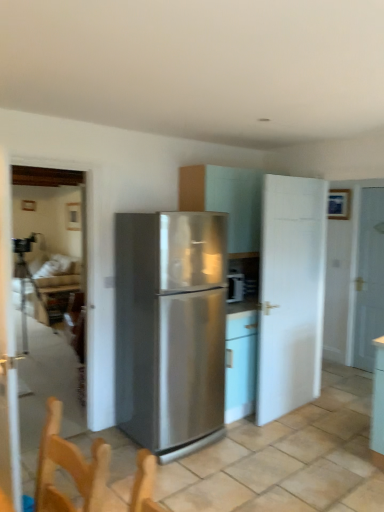
Question: Is clear glass door at left, the 1th glass door viewed from the back, taller or shorter than stainless steel refrigerator at center?

Choices:
 (A) short
 (B) tall

Answer: (B)

Question: In the image, is clear glass door at left, which ranks as the 2th glass door in front-to-back order, on the left side or the right side of stainless steel refrigerator at center?

Choices:
 (A) right
 (B) left

Answer: (B)

Question: Which object is the closest to the wooden table at lower left?

Choices:
 (A) matte white cabinet at center
 (B) stainless steel refrigerator at center
 (C) clear glass door at left, the 1th glass door viewed from the back
 (D) white matte door at right, the second door viewed from the left
 (E) transparent glass door at left, which is the first glass door from front to back

Answer: (C)

Question: Estimate the real-world distances between objects in this image. Which object is closer to the white matte door at center-right, acting as the 1th door starting from the front?

Choices:
 (A) matte white cabinet at center
 (B) wooden table at lower left
 (C) stainless steel refrigerator at center
 (D) white matte door at right, the second door viewed from the left
 (E) transparent glass door at left, which is the first glass door from front to back

Answer: (A)